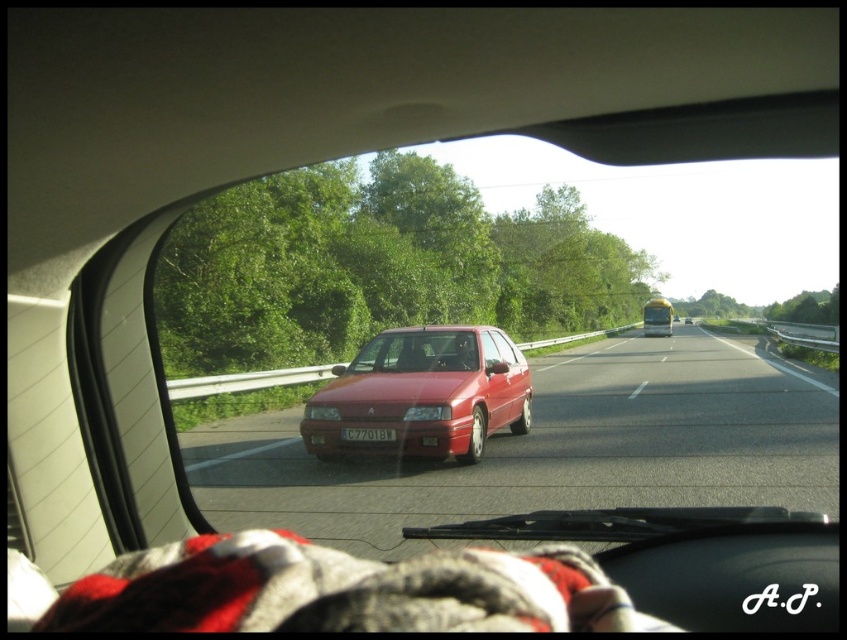
Question: Is matte red car at center closer to camera compared to yellow matte license plate at center?

Choices:
 (A) no
 (B) yes

Answer: (B)

Question: Can you confirm if glossy red car at center is positioned above yellow matte license plate at center?

Choices:
 (A) no
 (B) yes

Answer: (A)

Question: Which object appears farthest from the camera in this image?

Choices:
 (A) matte red car at center
 (B) glossy red car at center
 (C) yellow matte license plate at center

Answer: (C)

Question: Which object appears farthest from the camera in this image?

Choices:
 (A) yellow matte license plate at center
 (B) glossy red car at center

Answer: (A)

Question: Does matte red car at center have a greater width compared to yellow matte license plate at center?

Choices:
 (A) yes
 (B) no

Answer: (A)

Question: Considering the real-world distances, which object is farthest from the glossy red car at center?

Choices:
 (A) matte red car at center
 (B) yellow matte license plate at center

Answer: (B)